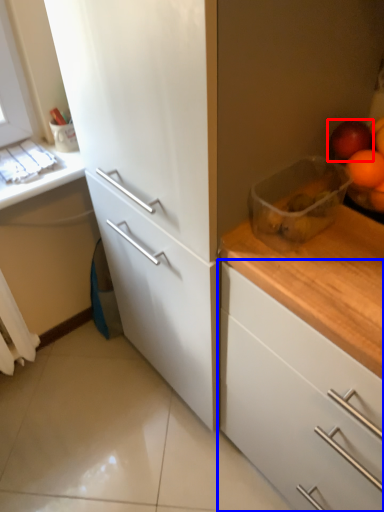
Question: Which point is further to the camera, apple (highlighted by a red box) or cabinetry (highlighted by a blue box)?

Choices:
 (A) apple
 (B) cabinetry

Answer: (A)